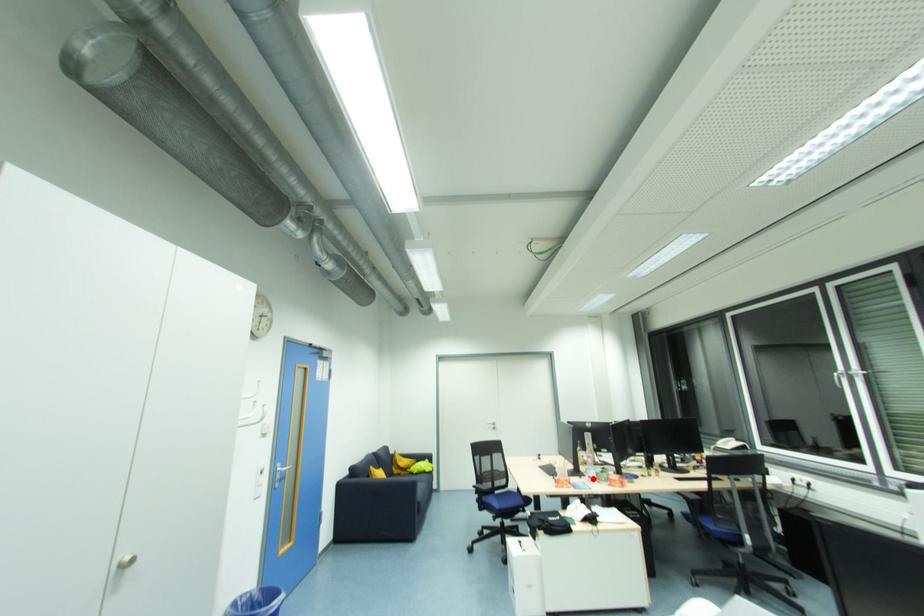
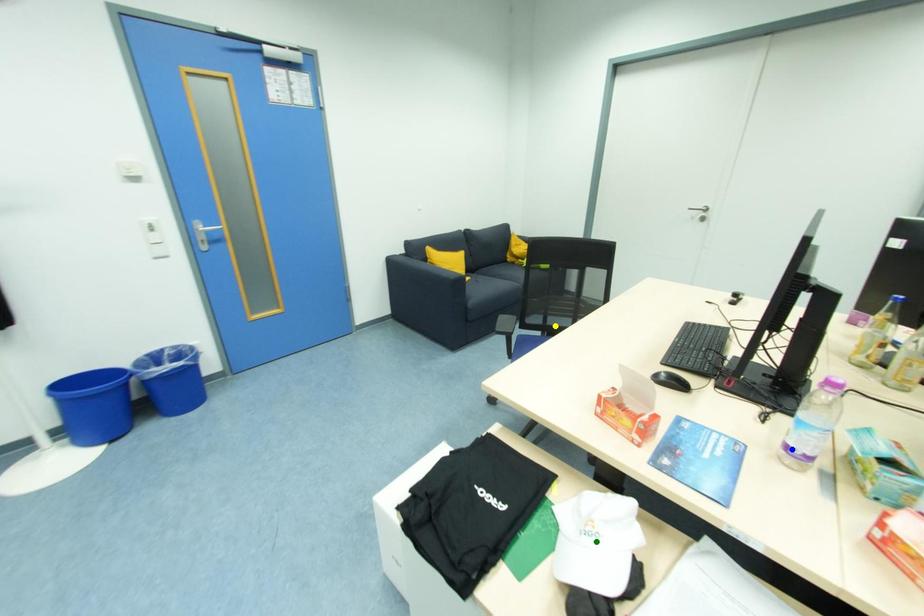
Question: I am providing you with two images of the same scene from different viewpoints. A red point is marked on the first image. You are given multiple points on the second image. Which point in image 2 represents the same 3d spot as the red point in image 1?

Choices:
 (A) green point
 (B) blue point
 (C) yellow point

Answer: (B)